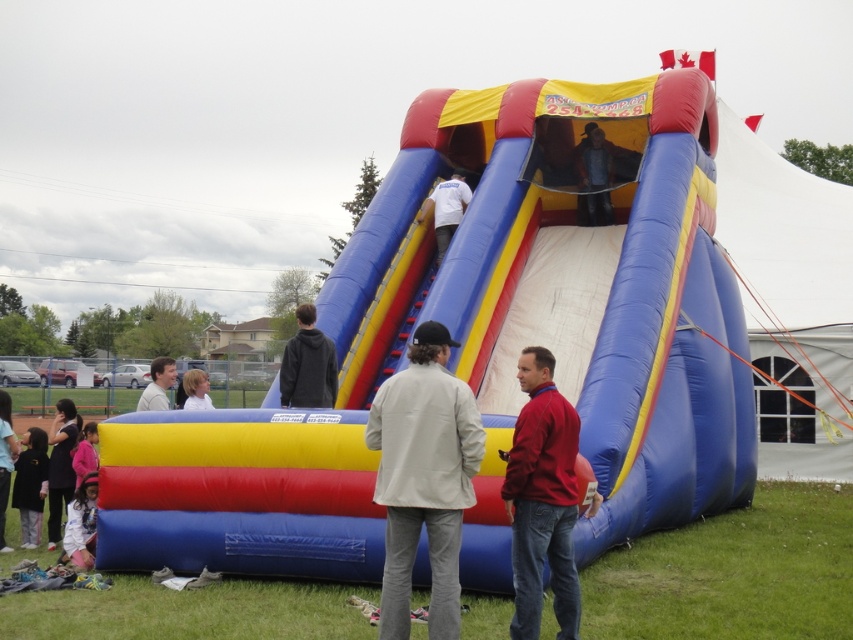
Question: Which of the following is the farthest from the observer?

Choices:
 (A) red matte jacket at lower right
 (B) light brown hair at lower left

Answer: (B)

Question: Is light pink fleece jacket at lower left thinner than pink fabric child at lower left?

Choices:
 (A) yes
 (B) no

Answer: (A)

Question: Among these objects, which one is nearest to the camera?

Choices:
 (A) white matte shirt at center
 (B) light brown hair at lower left

Answer: (B)

Question: Observing the image, what is the correct spatial positioning of red matte jacket at lower right in reference to pink fabric child at lower left?

Choices:
 (A) below
 (B) above

Answer: (A)

Question: Considering the real-world distances, which object is closest to the beige fabric jacket at center?

Choices:
 (A) blue inflatable slide at center
 (B) light brown hair at lower left
 (C) dark gray hoodie at center
 (D) white matte shirt at center

Answer: (C)

Question: Can you confirm if brown leather jacket at center is positioned above pink fabric child at lower left?

Choices:
 (A) yes
 (B) no

Answer: (A)